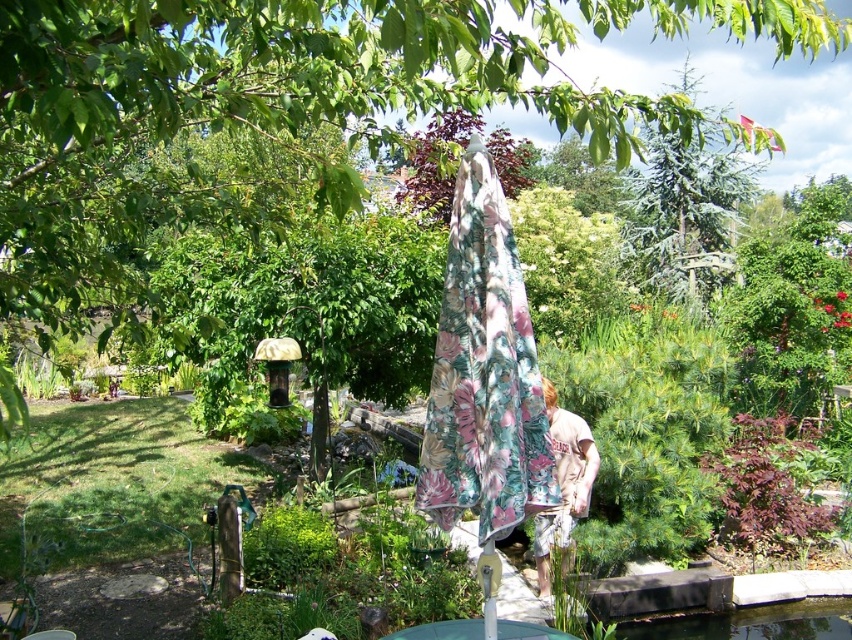
Question: Which point is farther to the camera?

Choices:
 (A) floral fabric umbrella at center
 (B) green textured pine tree at upper right

Answer: (B)

Question: Is green leafy tree at center positioned in front of green textured pine tree at upper right?

Choices:
 (A) yes
 (B) no

Answer: (A)

Question: Can you confirm if green leafy tree at center is positioned above floral fabric umbrella at center?

Choices:
 (A) yes
 (B) no

Answer: (A)

Question: Among these objects, which one is nearest to the camera?

Choices:
 (A) green textured pine tree at upper right
 (B) floral fabric umbrella at center
 (C) transparent glass pond at lower center

Answer: (B)

Question: Is floral fabric umbrella at center below transparent glass pond at lower center?

Choices:
 (A) yes
 (B) no

Answer: (B)

Question: Among these objects, which one is farthest from the camera?

Choices:
 (A) transparent glass pond at lower center
 (B) green leafy tree at center
 (C) floral fabric umbrella at center
 (D) green textured pine tree at upper right

Answer: (D)